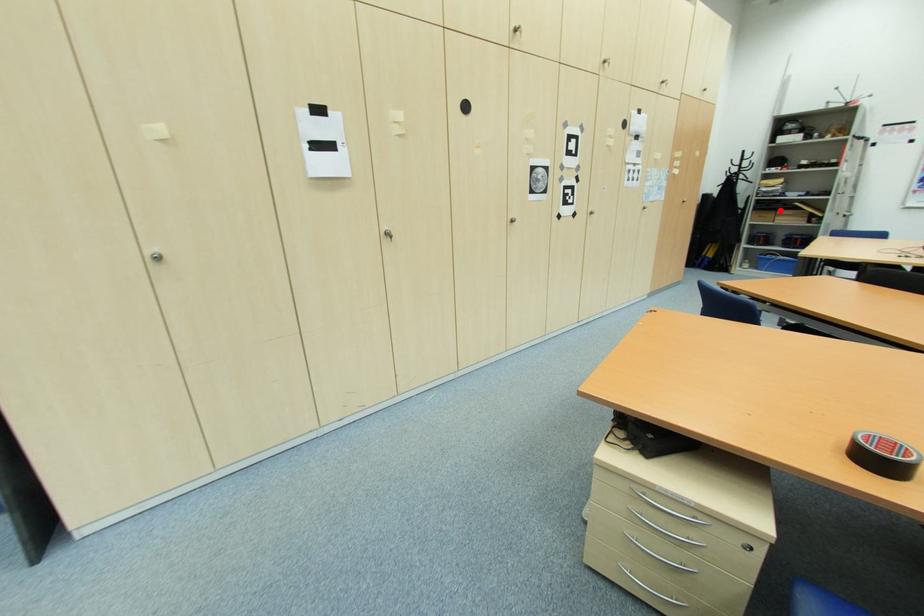
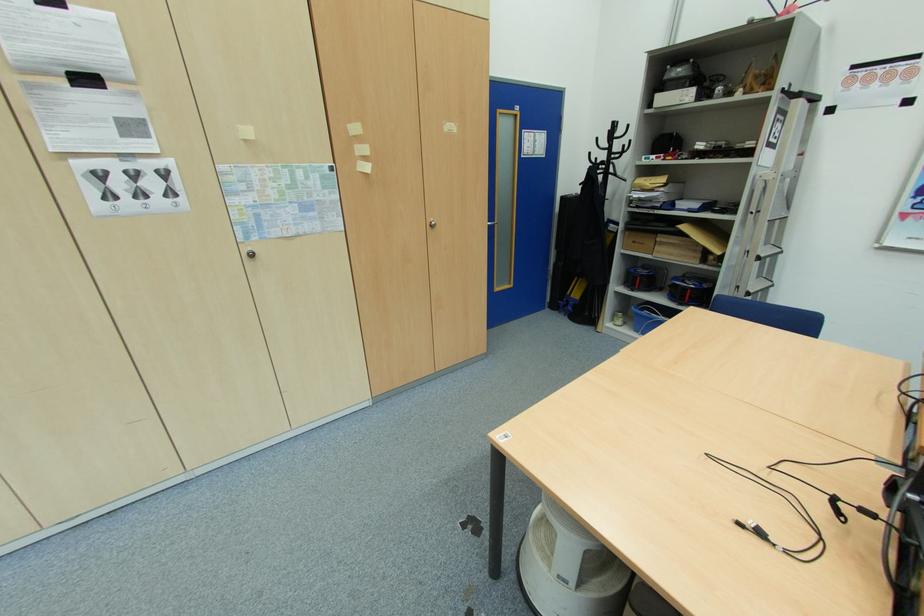
Question: I am providing you with two images of the same scene from different viewpoints. Given a red point in image1, look at the same physical point in image2. Is it:

Choices:
 (A) Closer to the viewpoint
 (B) Farther from the viewpoint

Answer: (A)